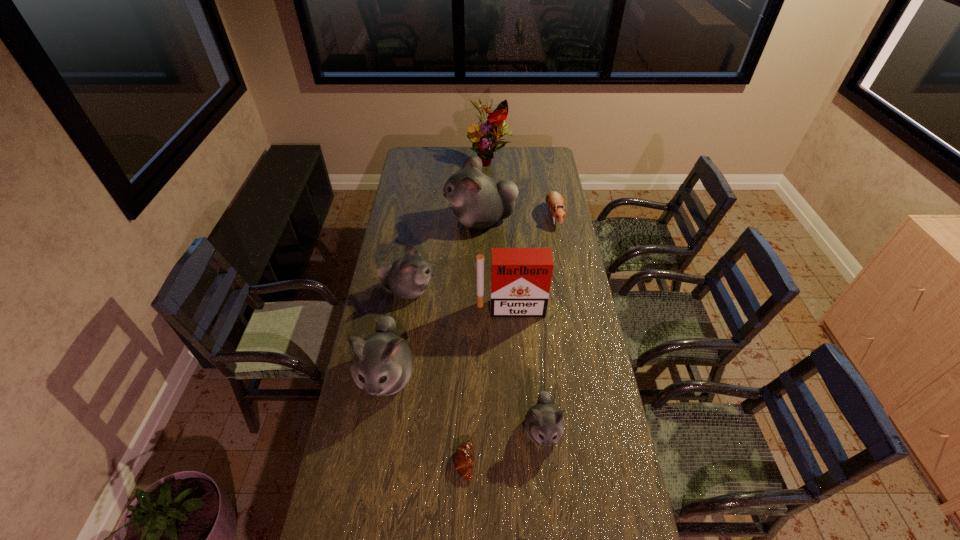
Where is `vacant area that lies between the bouquet and the third farthest hamster`? The image size is (960, 540). vacant area that lies between the bouquet and the third farthest hamster is located at coordinates (449, 225).

Identify the location of vacant area between the fourth shortest hamster and the crescent roll. The height and width of the screenshot is (540, 960). pyautogui.click(x=425, y=419).

Identify the location of free space between the brown crescent roll and the red cigarette case. The height and width of the screenshot is (540, 960). (488, 385).

In order to click on unoccupied area between the rightmost object and the third farthest hamster in this screenshot , I will do `click(481, 253)`.

Select which object is the third closest to the sixth tallest object. Please provide its 2D coordinates. Your answer should be formatted as a tuple, i.e. [(x, y)], where the tuple contains the x and y coordinates of a point satisfying the conditions above.

[(521, 278)]

Where is `object that stands as the seventh closest to the shortest object`? The width and height of the screenshot is (960, 540). object that stands as the seventh closest to the shortest object is located at coordinates (491, 131).

Locate which hamster is the closest to the shortest hamster. Please provide its 2D coordinates. Your answer should be formatted as a tuple, i.e. [(x, y)], where the tuple contains the x and y coordinates of a point satisfying the conditions above.

[(478, 201)]

Image resolution: width=960 pixels, height=540 pixels. I want to click on the second closest hamster to the bouquet, so click(x=554, y=200).

Where is `white hamster identified as the second closest to the third smallest white hamster`? The image size is (960, 540). white hamster identified as the second closest to the third smallest white hamster is located at coordinates (544, 425).

Find the location of a particular element. The height and width of the screenshot is (540, 960). white hamster that is the second closest one to the cigarette case is located at coordinates (382, 364).